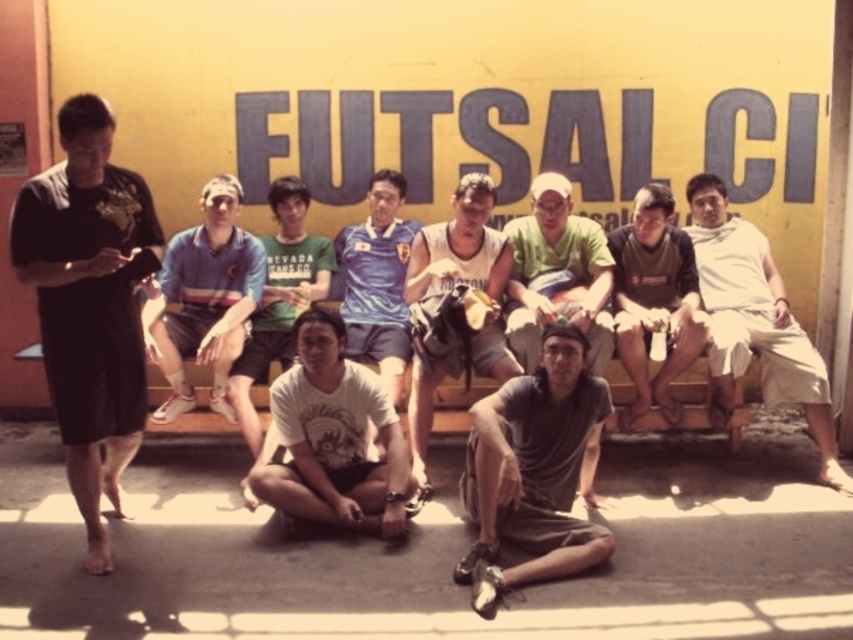
You are a photographer trying to arrange the group for a photo. You notice two shirts at the center of the image. Which one is smaller in size between the dark green jersey at center and the light green fabric shirt at center?

The dark green jersey at center is smaller in size compared to the light green fabric shirt at center.